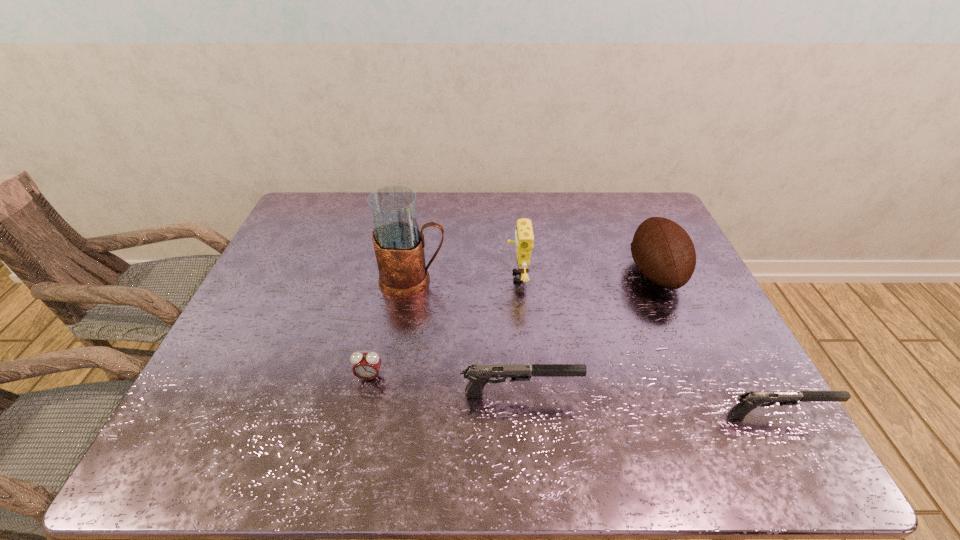
Where is `vacant space located 0.140m on the face of the sponge`? vacant space located 0.140m on the face of the sponge is located at coordinates (458, 276).

You are a GUI agent. You are given a task and a screenshot of the screen. Output one action in this format:
    pyautogui.click(x=<x>, y=<y>)
    Task: Click on the vacant space situated 0.320m on the face of the sponge
    The image size is (960, 540).
    Given the screenshot: What is the action you would take?
    pyautogui.click(x=396, y=276)

You are a GUI agent. You are given a task and a screenshot of the screen. Output one action in this format:
    pyautogui.click(x=<x>, y=<y>)
    Task: Click on the free location located 0.070m on the face of the sponge
    
    Given the screenshot: What is the action you would take?
    pyautogui.click(x=482, y=276)

In order to click on vacant region located 0.320m on the laces of the football in this screenshot , I will do `click(520, 273)`.

Find the location of a particular element. vacant space located on the laces of the football is located at coordinates (534, 273).

Where is `vacant space located 0.190m on the laces of the football`? The image size is (960, 540). vacant space located 0.190m on the laces of the football is located at coordinates (564, 273).

You are a GUI agent. You are given a task and a screenshot of the screen. Output one action in this format:
    pyautogui.click(x=<x>, y=<y>)
    Task: Click on the alarm clock located at the near edge
    This screenshot has height=540, width=960.
    Given the screenshot: What is the action you would take?
    pyautogui.click(x=366, y=366)

Locate an element on the screen. gun present at the right edge is located at coordinates (749, 400).

Find the location of a particular element. football that is at the right edge is located at coordinates (663, 251).

I want to click on object that is at the near right corner, so click(x=749, y=400).